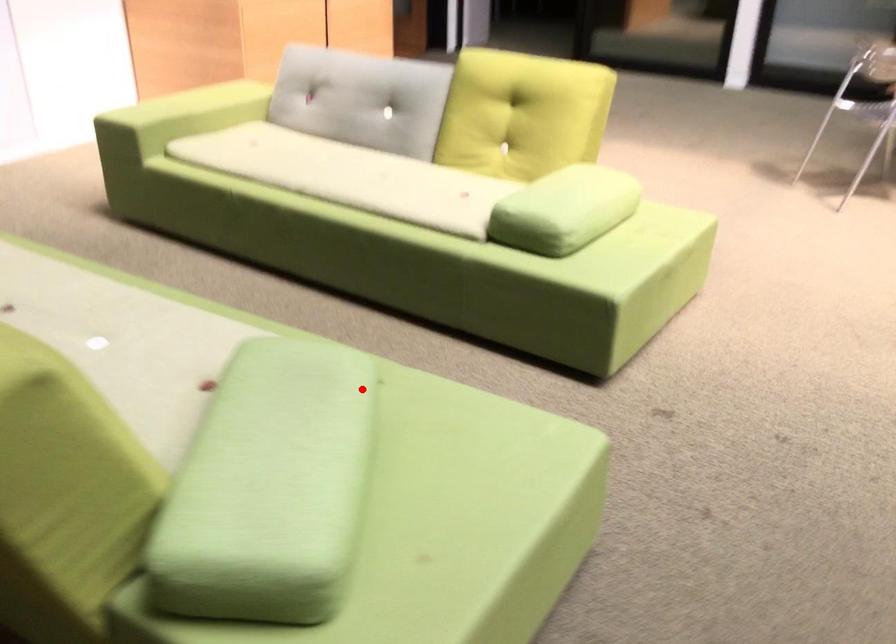
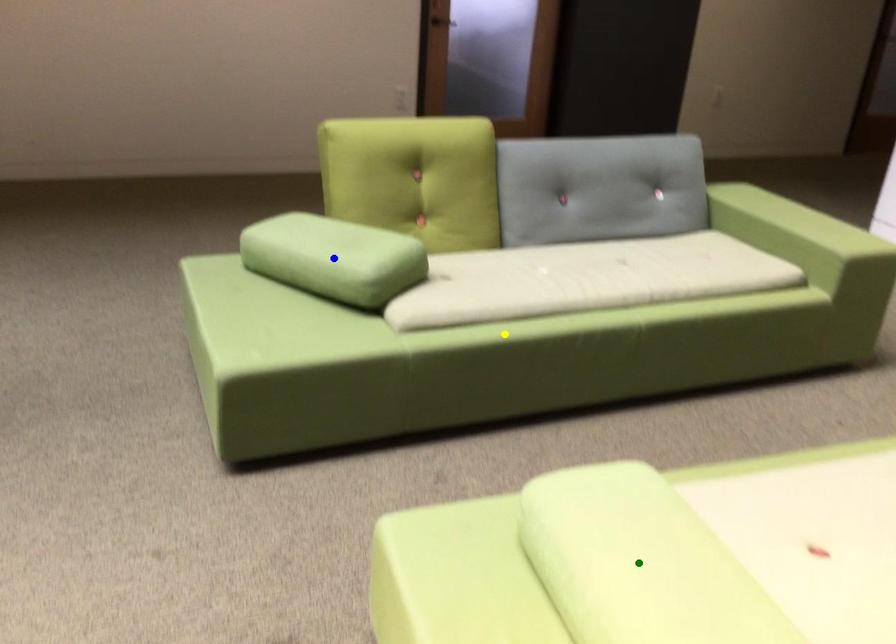
Question: I am providing you with two images of the same scene from different viewpoints. A red point is marked on the first image. You are given multiple points on the second image. Which point in image 2 is actually the same real-world point as the red point in image 1?

Choices:
 (A) blue point
 (B) green point
 (C) yellow point

Answer: (A)